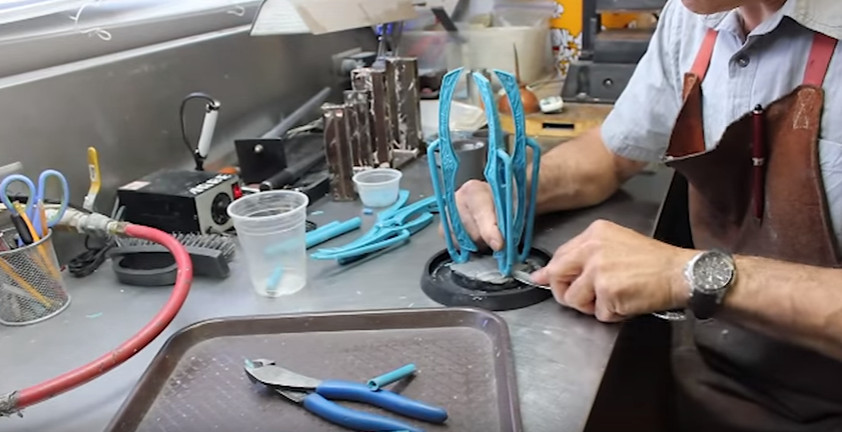
Locate an element on the screen. This screenshot has width=842, height=432. plastic cups is located at coordinates (276, 234), (376, 181).